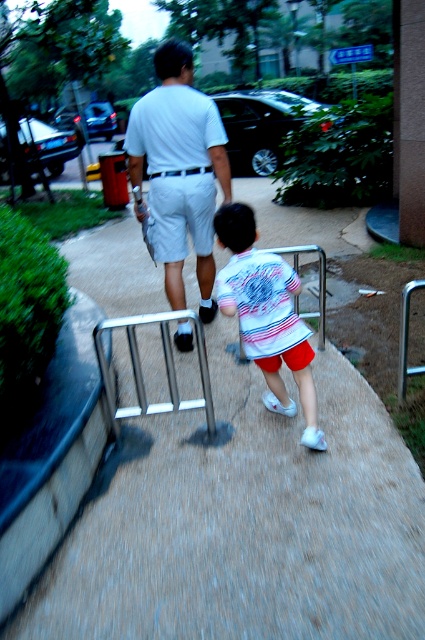
Question: Which point is farther to the camera?

Choices:
 (A) (207, 228)
 (B) (265, 330)
 (C) (295, 493)

Answer: (A)

Question: Is white printed shirt at center below white cotton shorts at center?

Choices:
 (A) no
 (B) yes

Answer: (B)

Question: Estimate the real-world distances between objects in this image. Which object is farther from the white cotton shirt at upper center?

Choices:
 (A) white cotton shorts at center
 (B) silver metallic rail at center

Answer: (B)

Question: Can you confirm if white cotton shirt at upper center is positioned to the right of white printed shirt at center?

Choices:
 (A) no
 (B) yes

Answer: (A)

Question: Based on their relative distances, which object is nearer to the white printed shirt at center?

Choices:
 (A) white cotton shorts at center
 (B) gray concrete pavement at center
 (C) silver metallic rail at center
 (D) white cotton shirt at upper center

Answer: (C)

Question: Can you confirm if gray concrete pavement at center is positioned below white cotton shirt at upper center?

Choices:
 (A) no
 (B) yes

Answer: (B)